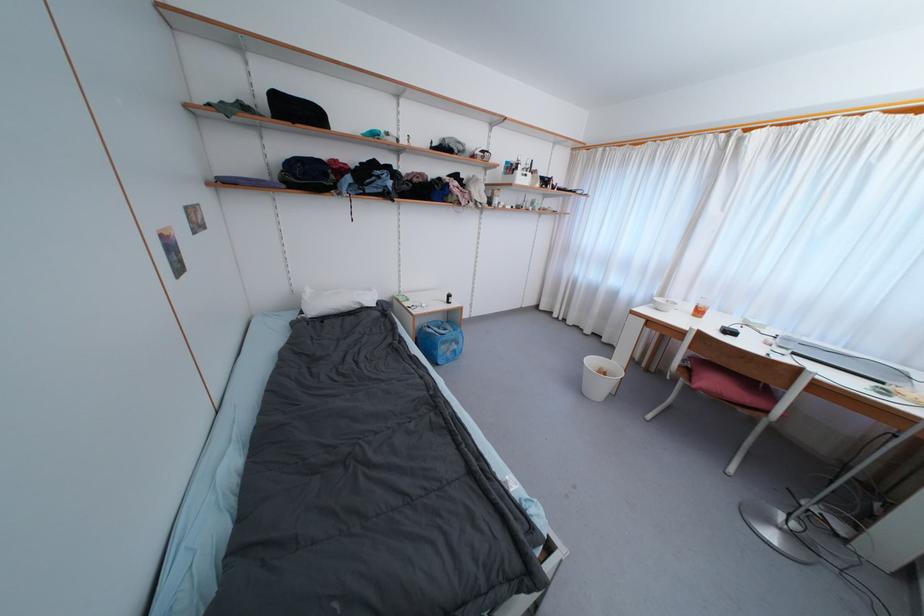
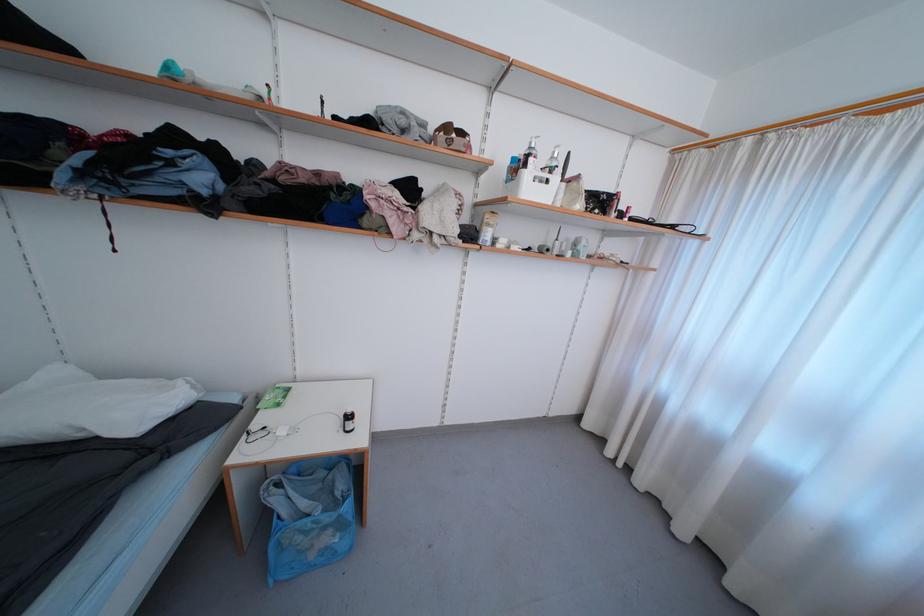
Where in the second image is the point corresponding to pixel 523 176 from the first image?

(531, 177)